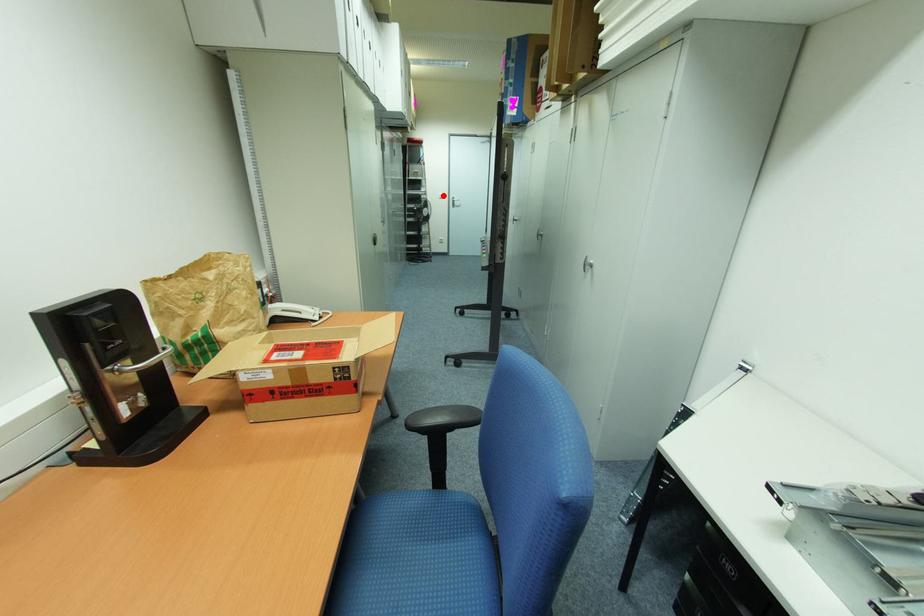
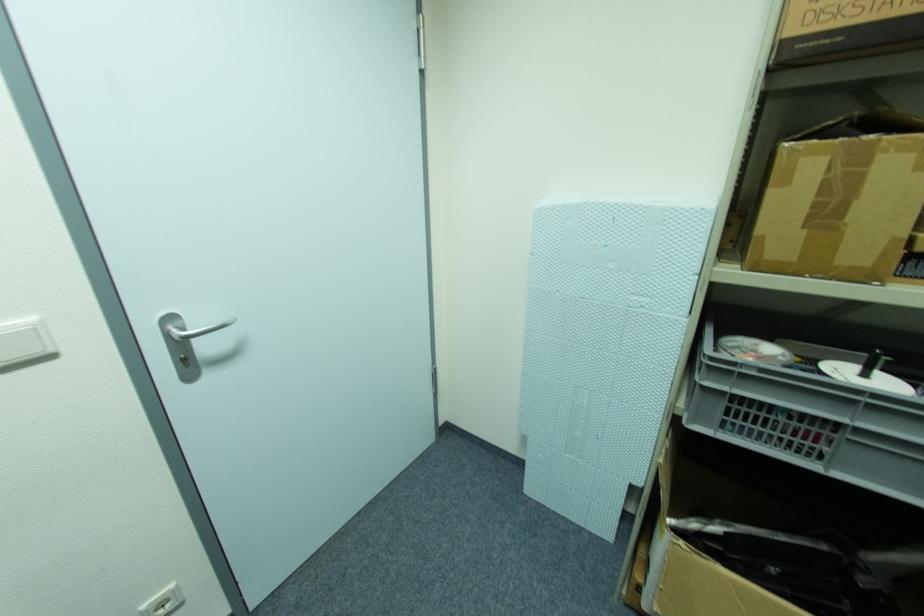
Question: I am providing you with two images of the same scene from different viewpoints. In image1, a red point is highlighted. Considering the same 3D point in image2, which of the following is correct?

Choices:
 (A) It is closer
 (B) It is farther

Answer: (B)